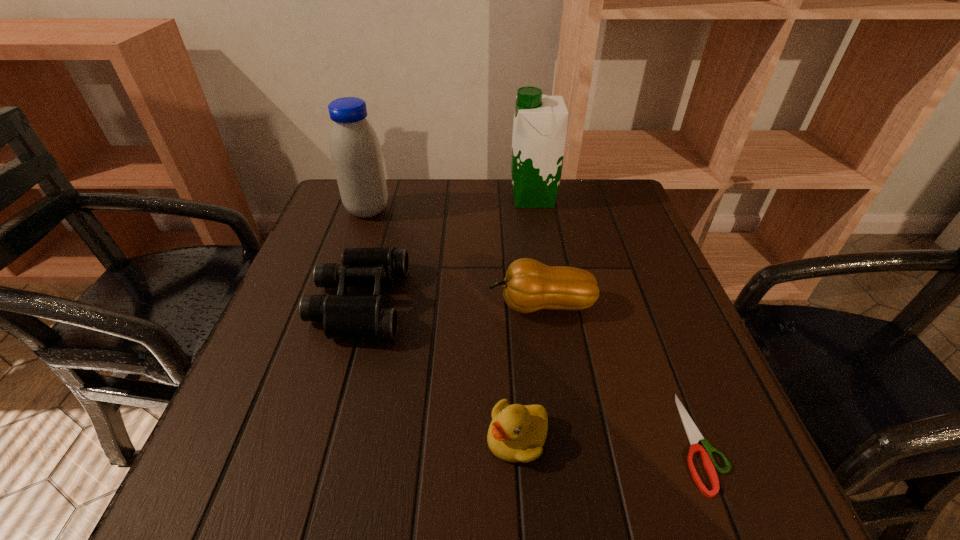
In order to click on vacant space that satisfies the following two spatial constraints: 1. on the beak of the shortest object; 2. on the left side of the fifth tallest object in this screenshot , I will do `click(517, 442)`.